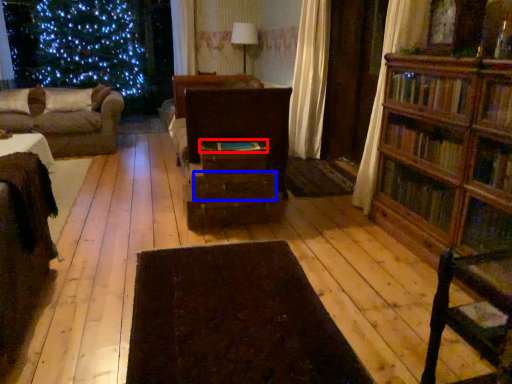
Question: Which point is further to the camera, book (highlighted by a red box) or drawer (highlighted by a blue box)?

Choices:
 (A) book
 (B) drawer

Answer: (A)